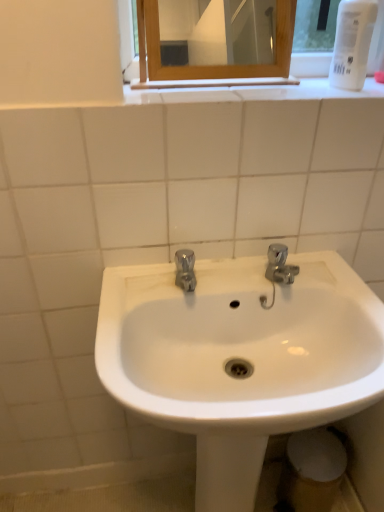
Question: Considering the positions of polished chrome faucet at center and white plastic bottle at upper right in the image, is polished chrome faucet at center bigger or smaller than white plastic bottle at upper right?

Choices:
 (A) big
 (B) small

Answer: (B)

Question: From the image's perspective, is polished chrome faucet at center above or below white plastic bottle at upper right?

Choices:
 (A) above
 (B) below

Answer: (B)

Question: Which is farther from the wooden-framed mirror at upper center?

Choices:
 (A) polished chrome faucet at center
 (B) white glossy sink at center
 (C) white plastic bottle at upper right

Answer: (A)

Question: Which object is positioned closest to the white glossy sink at center?

Choices:
 (A) wooden-framed mirror at upper center
 (B) polished chrome faucet at center
 (C) white plastic bottle at upper right

Answer: (B)